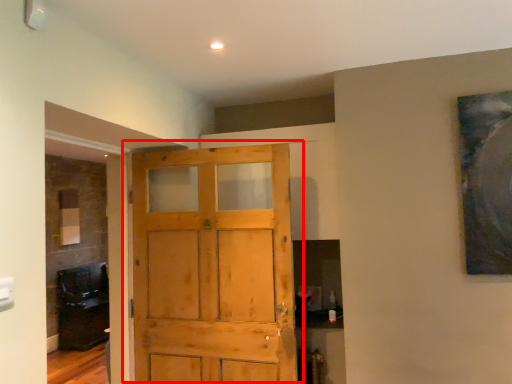
Question: From the image's perspective, what is the correct spatial relationship of door (annotated by the red box) in relation to cabinetry?

Choices:
 (A) above
 (B) below

Answer: (A)